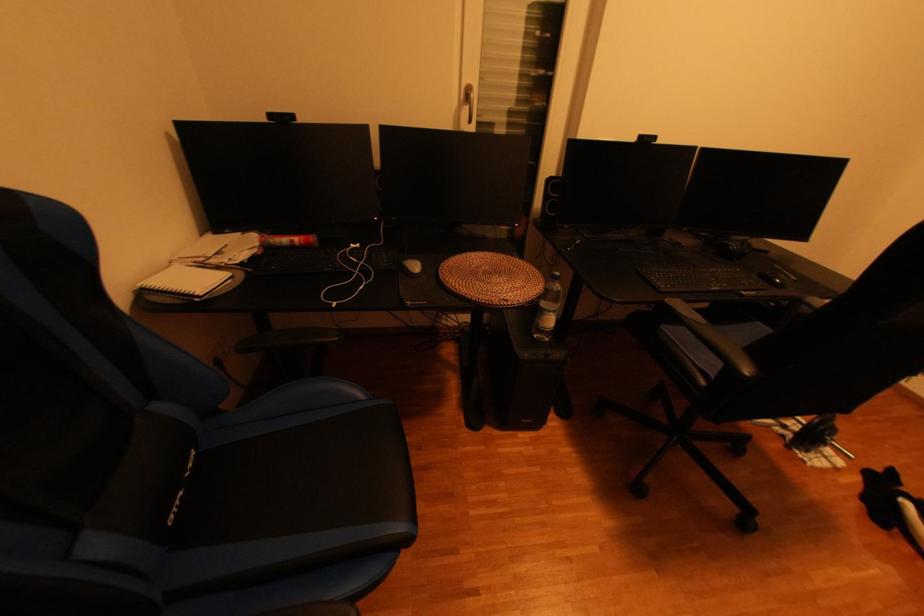
Describe the element at coordinates (411, 265) in the screenshot. I see `a gray computer mouse` at that location.